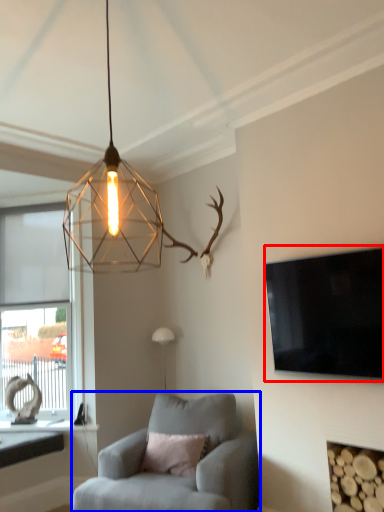
Question: Which object is closer to the camera taking this photo, television (highlighted by a red box) or chair (highlighted by a blue box)?

Choices:
 (A) television
 (B) chair

Answer: (A)